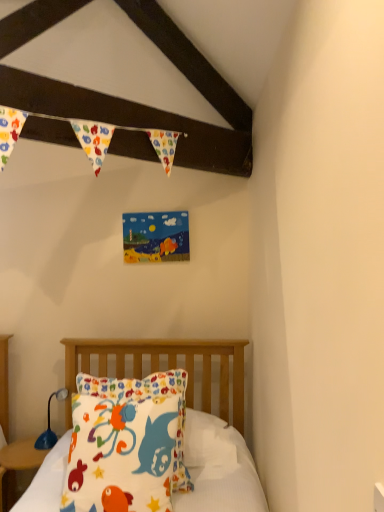
Question: Should I look upward or downward to see white cotton pillow at center?

Choices:
 (A) down
 (B) up

Answer: (A)

Question: Is fluffy cotton pillow at lower left outside of white cotton pillow at center?

Choices:
 (A) no
 (B) yes

Answer: (A)

Question: From a real-world perspective, is fluffy cotton pillow at lower left positioned under white cotton pillow at center based on gravity?

Choices:
 (A) no
 (B) yes

Answer: (A)

Question: Considering the relative sizes of fluffy cotton pillow at lower left and white cotton pillow at center in the image provided, is fluffy cotton pillow at lower left thinner than white cotton pillow at center?

Choices:
 (A) yes
 (B) no

Answer: (A)

Question: Is fluffy cotton pillow at lower left smaller than white cotton pillow at center?

Choices:
 (A) yes
 (B) no

Answer: (A)

Question: Does fluffy cotton pillow at lower left have a lesser height compared to white cotton pillow at center?

Choices:
 (A) yes
 (B) no

Answer: (A)

Question: Is fluffy cotton pillow at lower left looking in the opposite direction of white cotton pillow at center?

Choices:
 (A) no
 (B) yes

Answer: (B)

Question: From the image's perspective, is matte wood nightstand at lower left beneath blue plastic lamp at lower left?

Choices:
 (A) no
 (B) yes

Answer: (B)

Question: Considering the relative sizes of matte wood nightstand at lower left and blue plastic lamp at lower left in the image provided, is matte wood nightstand at lower left taller than blue plastic lamp at lower left?

Choices:
 (A) no
 (B) yes

Answer: (B)

Question: Is matte wood nightstand at lower left positioned with its back to blue plastic lamp at lower left?

Choices:
 (A) no
 (B) yes

Answer: (A)

Question: Are matte wood nightstand at lower left and blue plastic lamp at lower left located far from each other?

Choices:
 (A) yes
 (B) no

Answer: (B)

Question: From a real-world perspective, is matte wood nightstand at lower left below blue plastic lamp at lower left?

Choices:
 (A) no
 (B) yes

Answer: (B)

Question: Does matte wood nightstand at lower left have a greater width compared to blue plastic lamp at lower left?

Choices:
 (A) no
 (B) yes

Answer: (B)

Question: Is there a large distance between fluffy cotton pillow at lower left and blue plastic lamp at lower left?

Choices:
 (A) yes
 (B) no

Answer: (B)